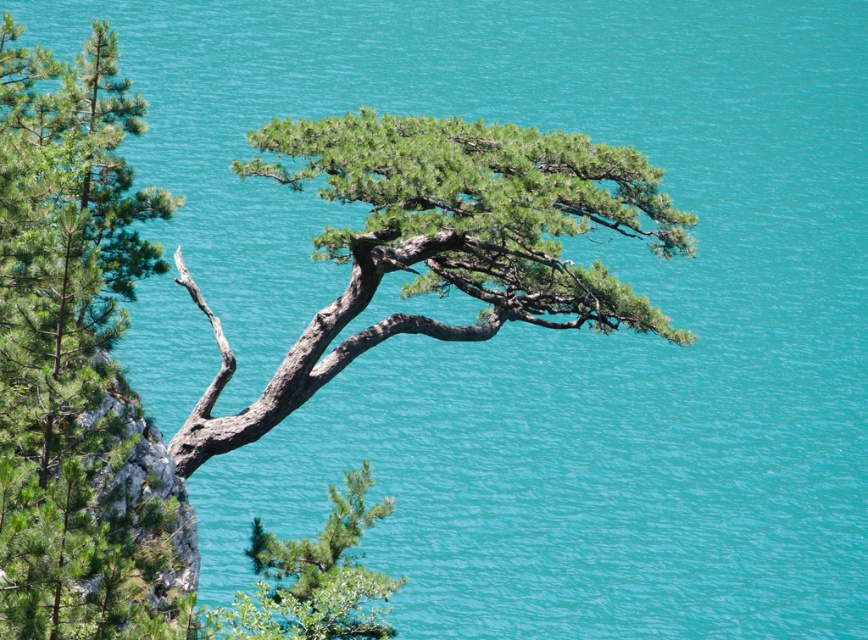
You are standing at the edge of the cliff looking at the pine tree. There are two points marked on the scene. The first point is located at coordinates point (237, 436) and the second at point (234, 628). Which point is closer to you?

Point (237, 436) is further to the camera than point (234, 628), so the point closer to you is point (234, 628).